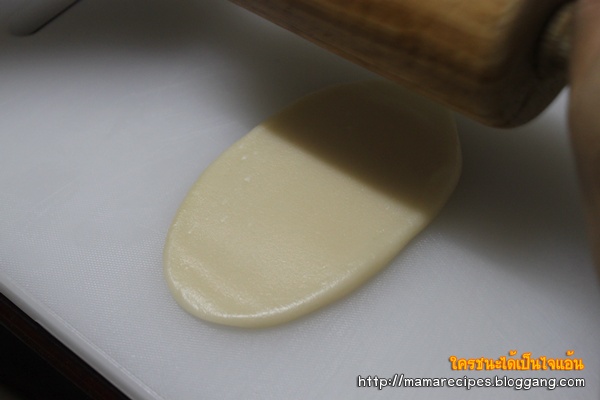
I want to click on handle of rolling pin, so click(563, 52).